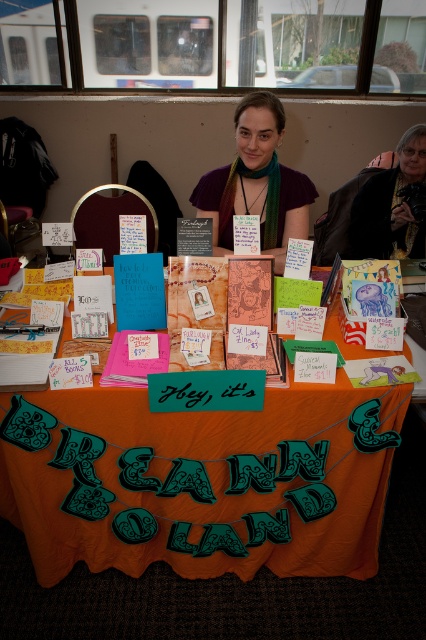
Is the position of orange fabric at center less distant than that of dark brown leather jacket at upper right?

That is True.

Between point (282, 420) and point (385, 179), which one is positioned behind?

The point (385, 179) is behind.

Is point (245, 563) closer to viewer compared to point (388, 196)?

That is True.

This screenshot has height=640, width=426. In order to click on orange fabric at center in this screenshot , I will do `click(201, 481)`.

Can you confirm if green knitted scarf at center is positioned above dark brown leather jacket at upper right?

Actually, green knitted scarf at center is below dark brown leather jacket at upper right.

Is green knitted scarf at center to the right of dark brown leather jacket at upper right from the viewer's perspective?

In fact, green knitted scarf at center is to the left of dark brown leather jacket at upper right.

What do you see at coordinates (256, 182) in the screenshot? The width and height of the screenshot is (426, 640). I see `green knitted scarf at center` at bounding box center [256, 182].

Identify the location of green knitted scarf at center. (256, 182).

Based on the photo, who is taller, orange fabric at center or green knitted scarf at center?

orange fabric at center is taller.

Locate an element on the screen. The height and width of the screenshot is (640, 426). orange fabric at center is located at coordinates [x=201, y=481].

Which is behind, point (340, 420) or point (279, 248)?

The point (279, 248) is more distant.

At what (x,y) coordinates should I click in order to perform the action: click on orange fabric at center. Please return your answer as a coordinate pair (x, y). The width and height of the screenshot is (426, 640). Looking at the image, I should click on (201, 481).